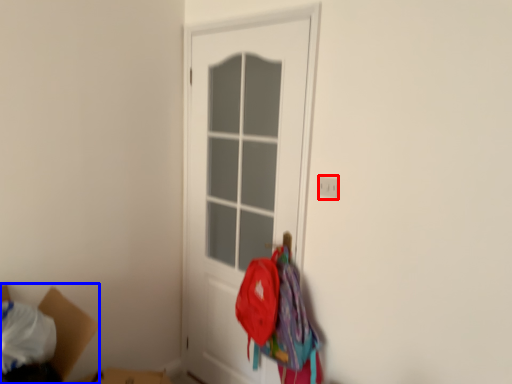
Question: Which of the following is the closest to the observer, electric outlet (highlighted by a red box) or cardboard box (highlighted by a blue box)?

Choices:
 (A) electric outlet
 (B) cardboard box

Answer: (B)